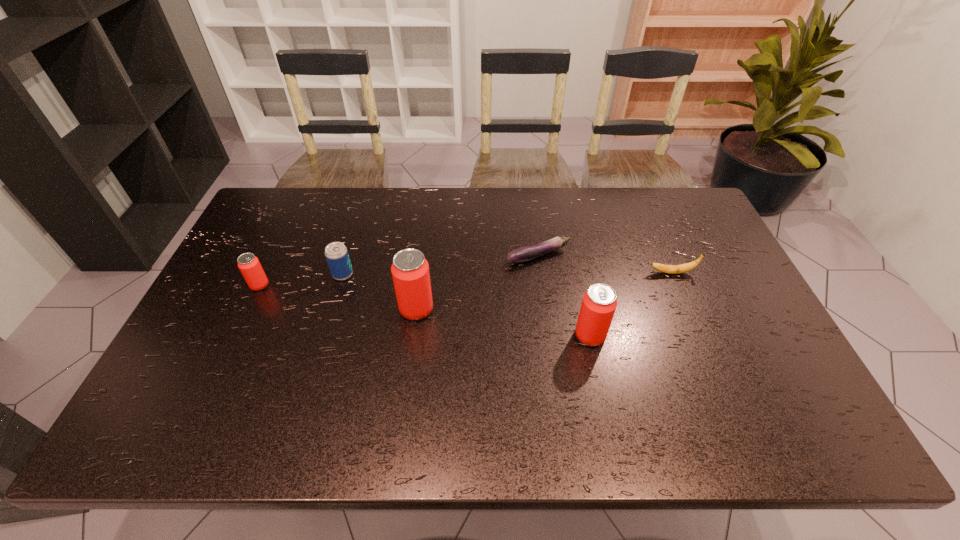
In the image, there is a desktop. Identify the location of vacant space at the near edge. The width and height of the screenshot is (960, 540). (277, 394).

Identify the location of vacant space at the left edge of the desktop. This screenshot has width=960, height=540. (237, 360).

Find the location of a particular element. vacant region at the right edge of the desktop is located at coordinates (714, 332).

Identify the location of blank space at the far left corner of the desktop. This screenshot has height=540, width=960. (272, 214).

Image resolution: width=960 pixels, height=540 pixels. I want to click on unoccupied position between the third object from left to right and the second beer can from left to right, so click(380, 292).

At what (x,y) coordinates should I click in order to perform the action: click on free space between the rightmost beer can and the eggplant. Please return your answer as a coordinate pair (x, y). This screenshot has height=540, width=960. Looking at the image, I should click on (564, 296).

The width and height of the screenshot is (960, 540). Identify the location of blank region between the leftmost beer can and the third beer can from right to left. (301, 280).

You are a GUI agent. You are given a task and a screenshot of the screen. Output one action in this format:
    pyautogui.click(x=<x>, y=<y>)
    Task: Click on the free space between the fifth shortest object and the rightmost object
    
    Given the screenshot: What is the action you would take?
    pyautogui.click(x=631, y=304)

Find the location of `free spot between the fifth object from right to left and the leftmost object`. free spot between the fifth object from right to left and the leftmost object is located at coordinates (301, 280).

What are the coordinates of `free area in between the eggplant and the nearest beer can` in the screenshot? It's located at (564, 296).